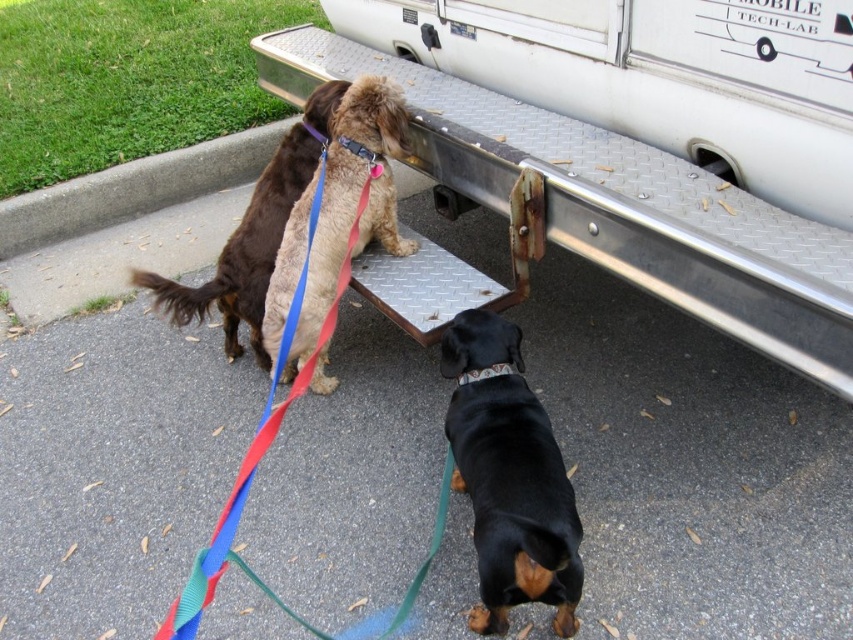
Question: In this image, where is black smooth dog at lower center located relative to fuzzy brown dog at center?

Choices:
 (A) above
 (B) below

Answer: (B)

Question: Is metallic trailer truck at upper center wider than fuzzy brown dog at center?

Choices:
 (A) no
 (B) yes

Answer: (B)

Question: Estimate the real-world distances between objects in this image. Which object is farther from the metallic trailer truck at upper center?

Choices:
 (A) brown fuzzy dog at upper left
 (B) black smooth dog at lower center
 (C) black fabric neckband at center

Answer: (C)

Question: Considering the relative positions of metallic trailer truck at upper center and fuzzy brown dog at center in the image provided, where is metallic trailer truck at upper center located with respect to fuzzy brown dog at center?

Choices:
 (A) right
 (B) left

Answer: (A)

Question: Which point appears closest to the camera in this image?

Choices:
 (A) (315, 36)
 (B) (505, 369)
 (C) (519, 579)
 (D) (219, 289)

Answer: (C)

Question: Which object is the closest to the black smooth dog at lower center?

Choices:
 (A) black fabric neckband at center
 (B) fuzzy brown dog at center
 (C) brown fuzzy dog at upper left

Answer: (A)